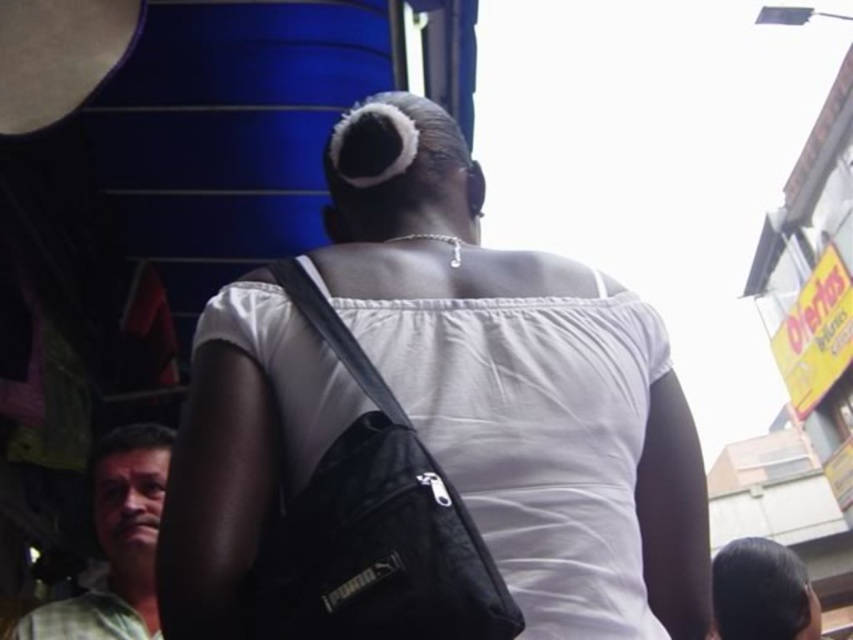
Question: Among these points, which one is farthest from the camera?

Choices:
 (A) (618, 388)
 (B) (142, 636)
 (C) (386, 426)

Answer: (B)

Question: Is white matte shoulder bag at center bigger than green plaid shirt at lower left?

Choices:
 (A) no
 (B) yes

Answer: (B)

Question: Which point is farther to the camera?

Choices:
 (A) black fabric shoulder bag at center
 (B) green plaid shirt at lower left

Answer: (B)

Question: Which object is positioned farthest from the white matte shoulder bag at center?

Choices:
 (A) black fabric shoulder bag at center
 (B) green plaid shirt at lower left

Answer: (B)

Question: Does white matte shoulder bag at center have a greater width compared to black fabric shoulder bag at center?

Choices:
 (A) no
 (B) yes

Answer: (B)

Question: Does black fabric shoulder bag at center come behind green plaid shirt at lower left?

Choices:
 (A) yes
 (B) no

Answer: (B)